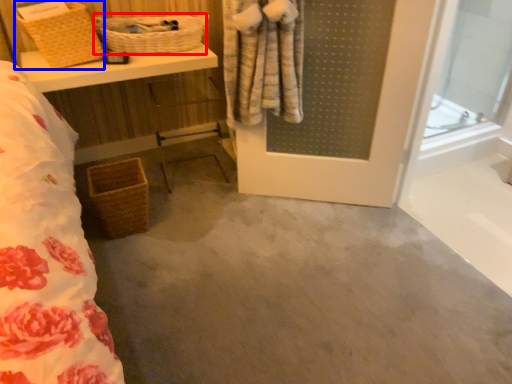
Question: Which of the following is the closest to the observer, basket (highlighted by a red box) or basket (highlighted by a blue box)?

Choices:
 (A) basket
 (B) basket

Answer: (B)